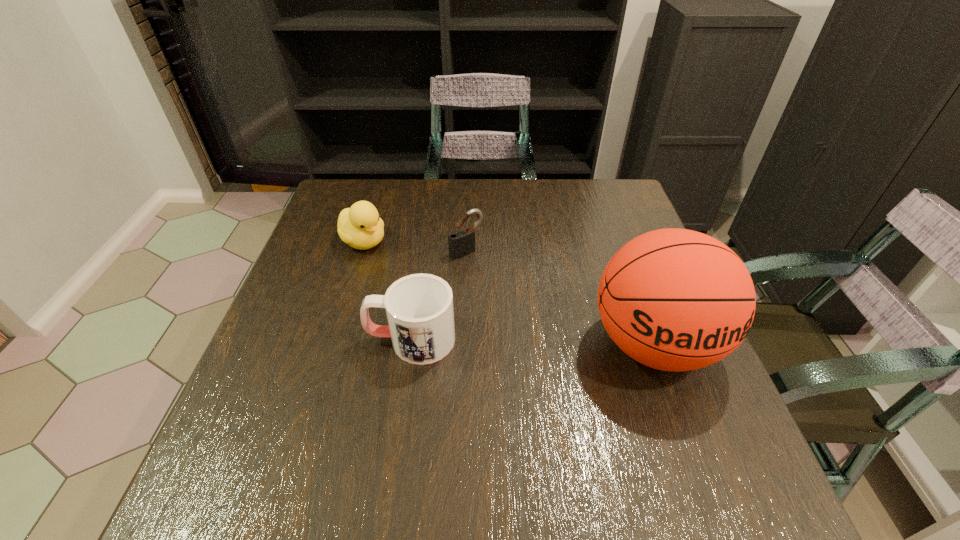
Find the location of a particular element. the second closest object to the mug is located at coordinates (359, 226).